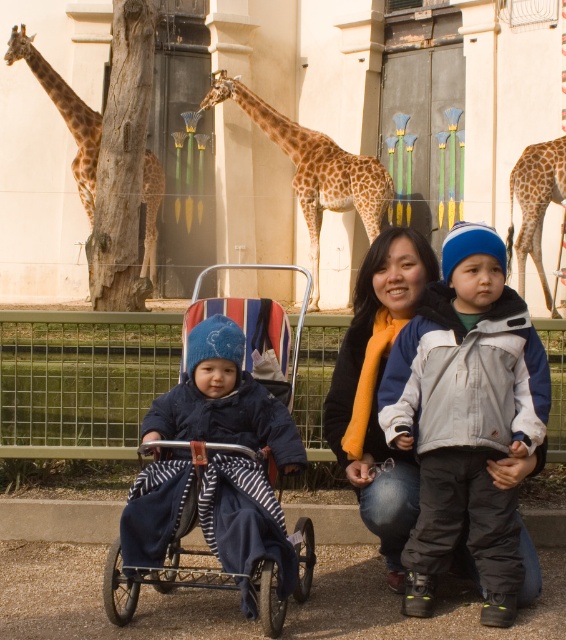
Question: Does gray fleece jacket at center come behind dark blue fabric baby carriage at left?

Choices:
 (A) yes
 (B) no

Answer: (A)

Question: Does spotted fur giraffe at left have a smaller size compared to spotted fur giraffe at upper right?

Choices:
 (A) no
 (B) yes

Answer: (A)

Question: Which of the following is the farthest from the observer?

Choices:
 (A) pos(242,464)
 (B) pos(85,150)
 (C) pos(529,189)
 (D) pos(469,365)

Answer: (B)

Question: Among these points, which one is farthest from the camera?

Choices:
 (A) (149, 436)
 (B) (370, 204)
 (C) (380, 416)

Answer: (B)

Question: Which of the following is the farthest from the observer?

Choices:
 (A) (550, 177)
 (B) (315, 189)

Answer: (B)

Question: Is the position of gray fleece jacket at center less distant than that of spotted fur giraffe at upper right?

Choices:
 (A) yes
 (B) no

Answer: (A)